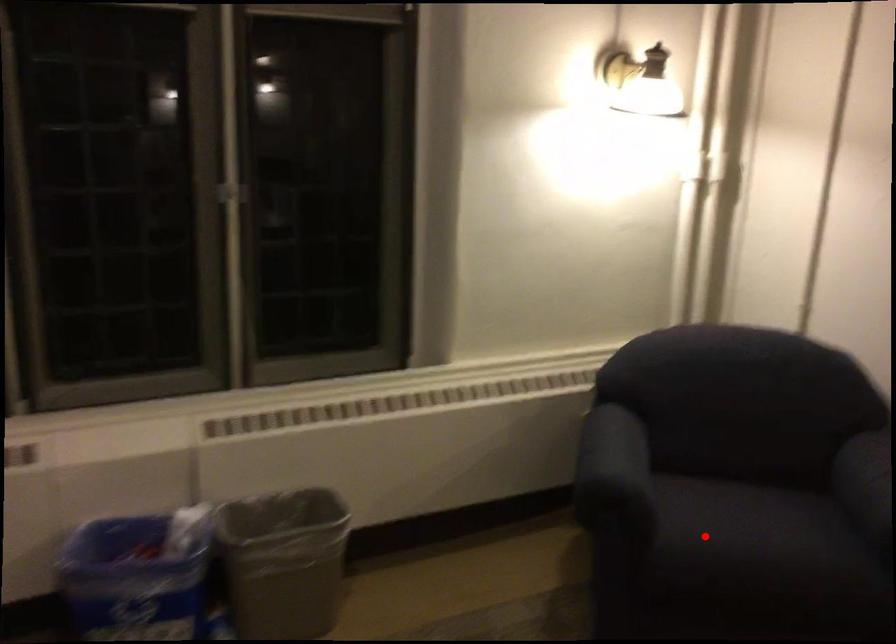
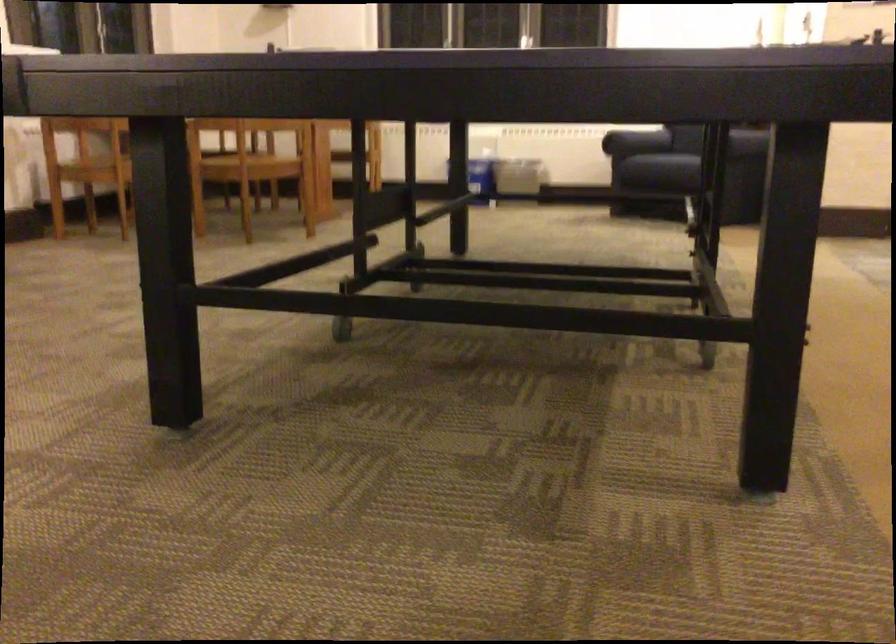
Locate, in the second image, the point that corresponds to the highlighted location in the first image.

(633, 143)